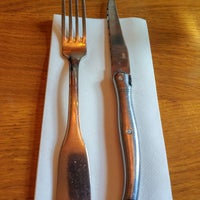
Locate an element on the screen. This screenshot has height=200, width=200. silver fork is located at coordinates (74, 80).